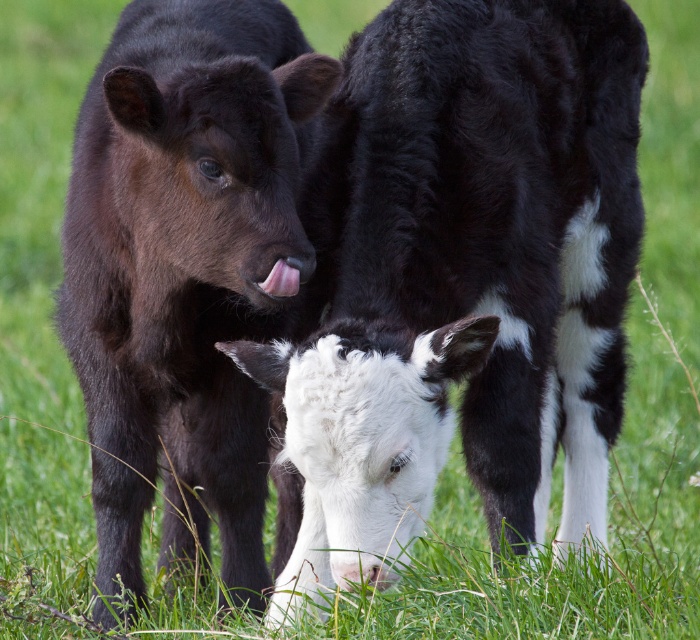
You are a farmer checking the health of your calves. You notice the black matte calf at left and the pink smooth tongue at center. Which of these two is taller?

The black matte calf at left is much taller than the pink smooth tongue at center.

You are a farmer checking on your calves. You see the black matte calf at left and the pink smooth tongue at center. How far apart are these two objects?

The black matte calf at left and the pink smooth tongue at center are 30.86 inches apart from each other.

You are a farmer checking the health of your calves. You notice the black matte calf at left and the pink smooth tongue at center. Which object is wider?

The black matte calf at left is wider than the pink smooth tongue at center.